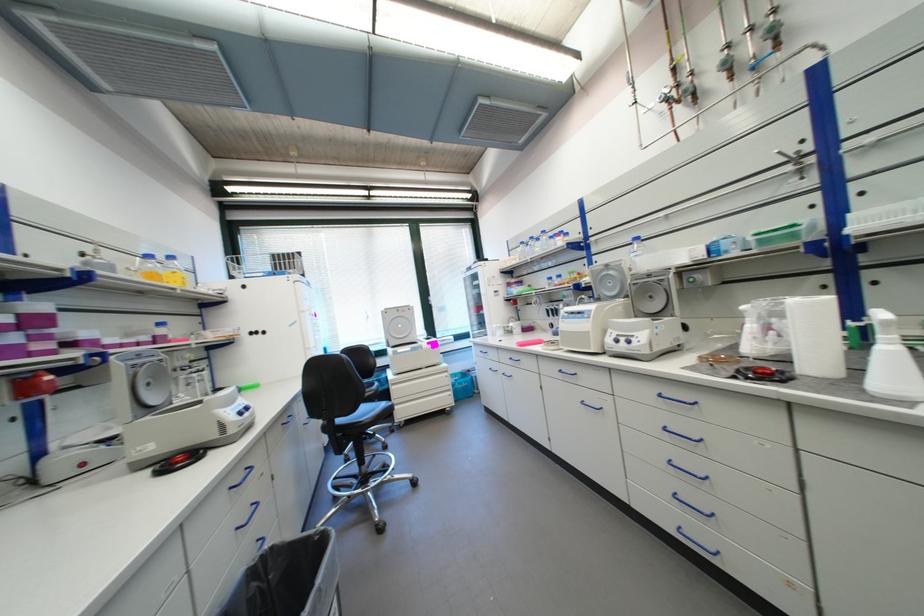
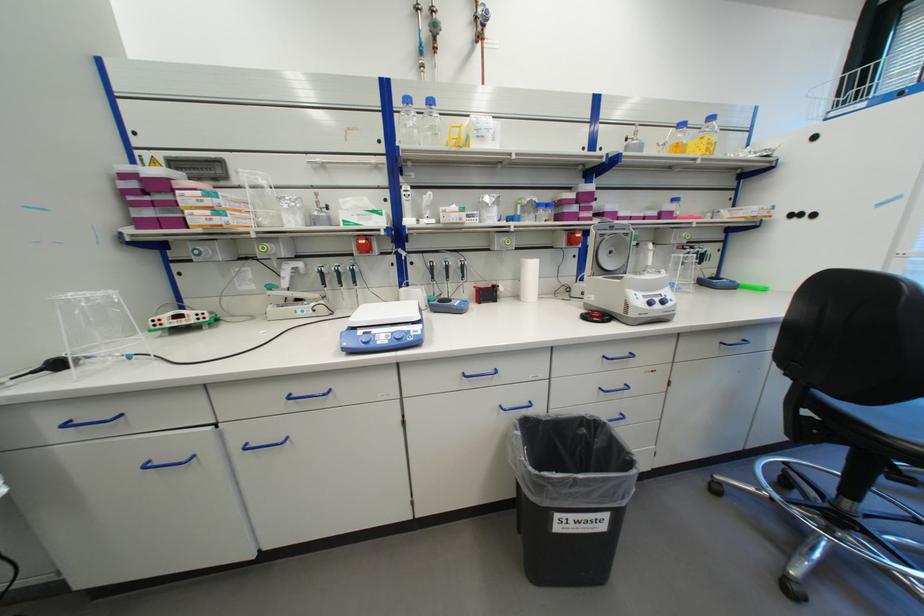
Where in the second image is the point corresponding to [162,402] from the first image?

(616, 267)